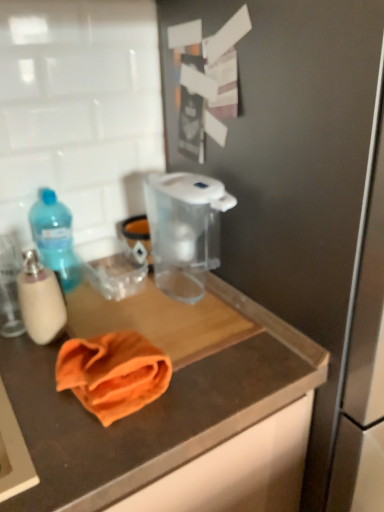
Identify the location of vacant space in front of transparent plastic pitcher at center. (180, 326).